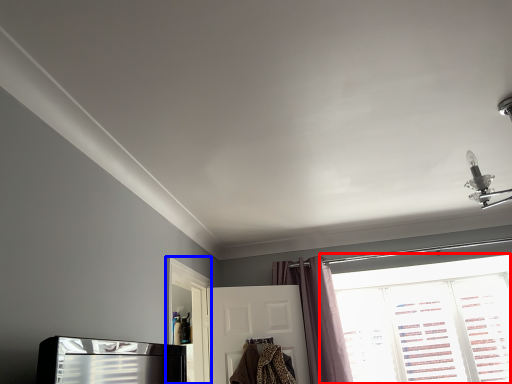
Question: Among these objects, which one is farthest to the camera, window (highlighted by a red box) or screen door (highlighted by a blue box)?

Choices:
 (A) window
 (B) screen door

Answer: (A)